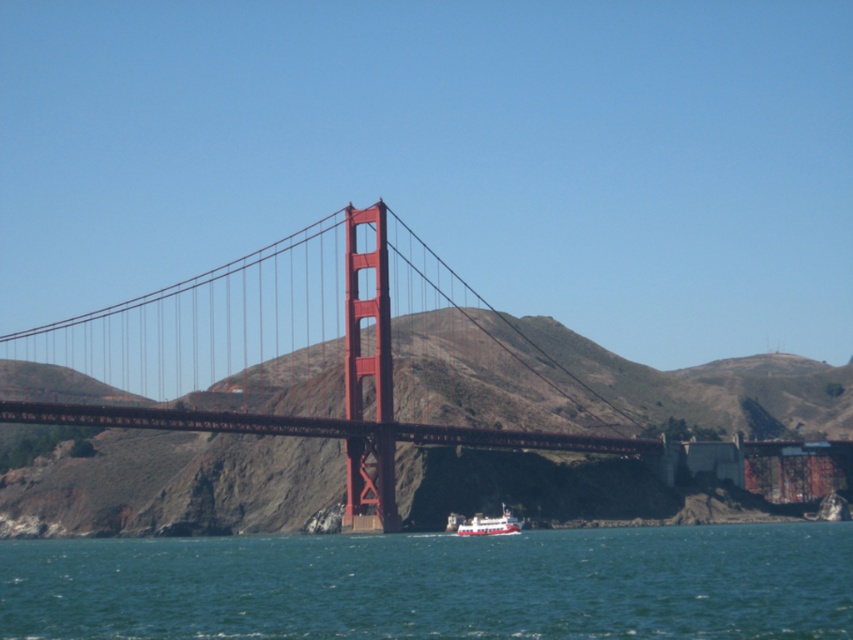
Question: Is glossy steel bridge at center below white plastic boat at lower center?

Choices:
 (A) no
 (B) yes

Answer: (A)

Question: Where is glossy steel bridge at center located in relation to blue water at lower center in the image?

Choices:
 (A) above
 (B) below

Answer: (A)

Question: Considering the real-world distances, which object is closest to the glossy steel bridge at center?

Choices:
 (A) blue water at lower center
 (B) white plastic boat at lower center

Answer: (A)

Question: Among these objects, which one is nearest to the camera?

Choices:
 (A) white plastic boat at lower center
 (B) glossy steel bridge at center

Answer: (B)

Question: Which point is closer to the camera?

Choices:
 (A) (445, 621)
 (B) (676, 476)

Answer: (A)

Question: Is the position of glossy steel bridge at center less distant than that of blue water at lower center?

Choices:
 (A) yes
 (B) no

Answer: (B)